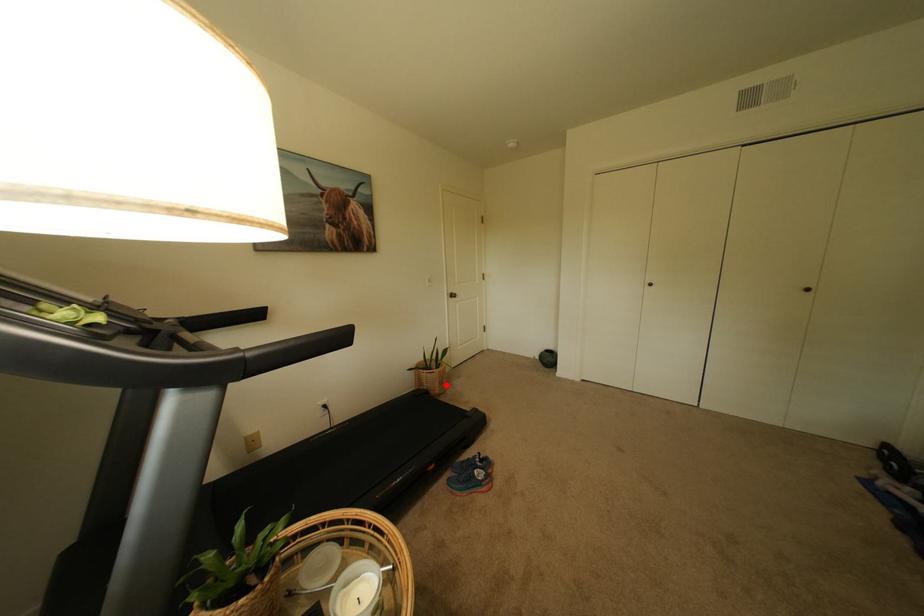
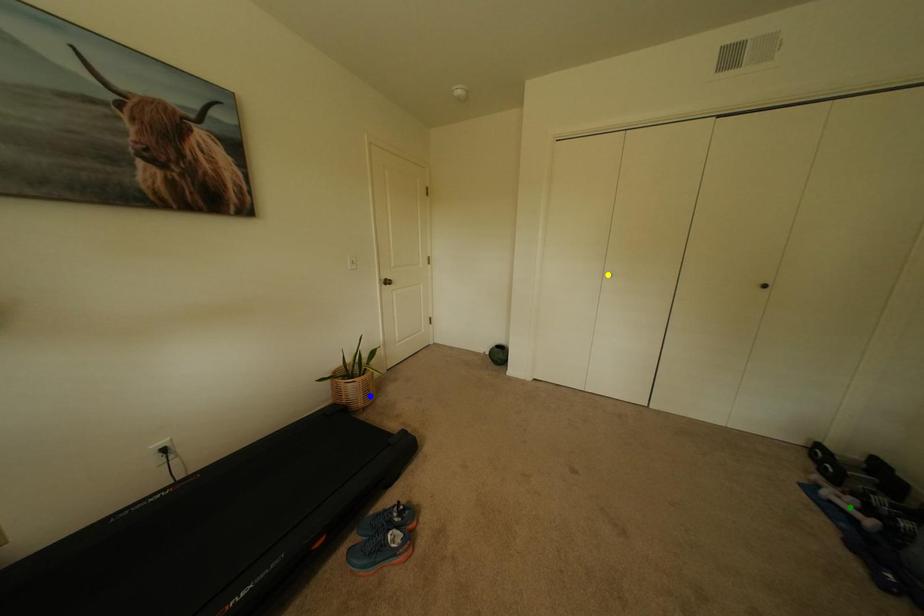
Question: I am providing you with two images of the same scene from different viewpoints. A red point is marked on the first image. You are given multiple points on the second image. Which point in image 2 represents the same 3d spot as the red point in image 1?

Choices:
 (A) blue point
 (B) yellow point
 (C) green point

Answer: (A)